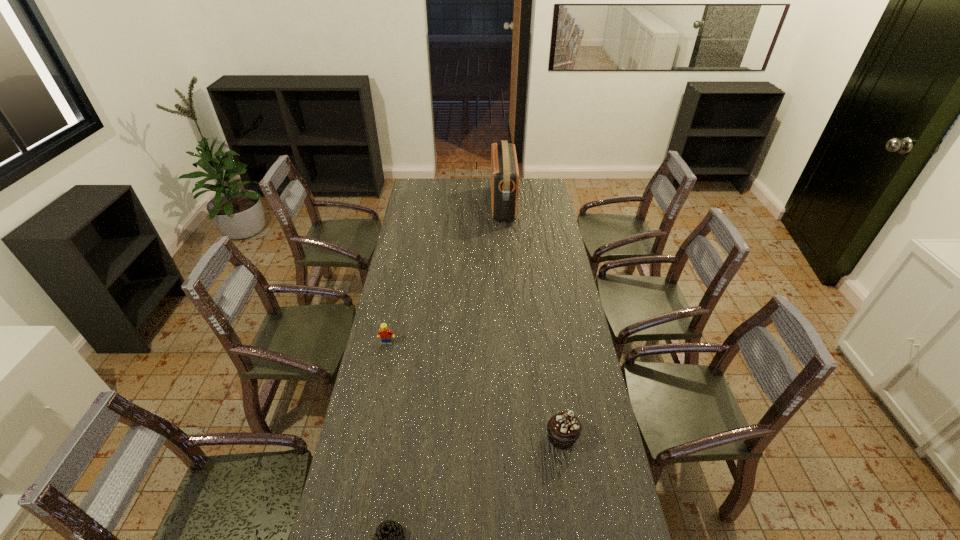
Identify the location of free spot that satisfies the following two spatial constraints: 1. on the back side of the second nearest object; 2. on the front-facing side of the third object from left to right. (527, 205).